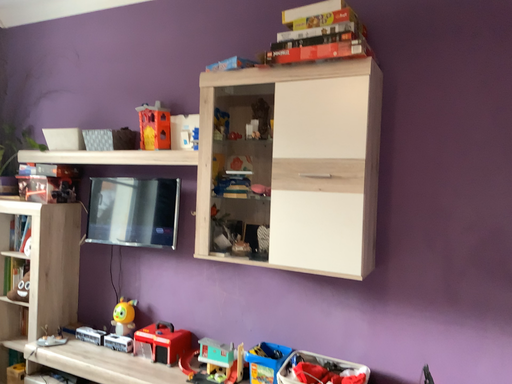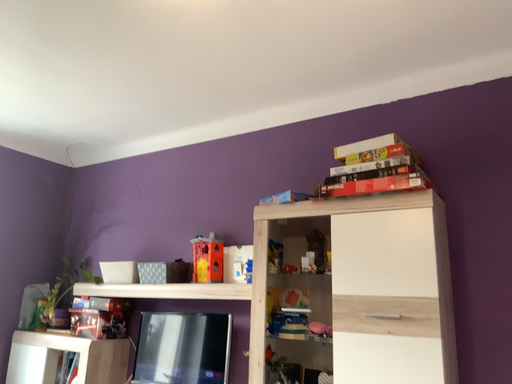
Question: How did the camera likely rotate when shooting the video?

Choices:
 (A) rotated upward
 (B) rotated downward

Answer: (A)